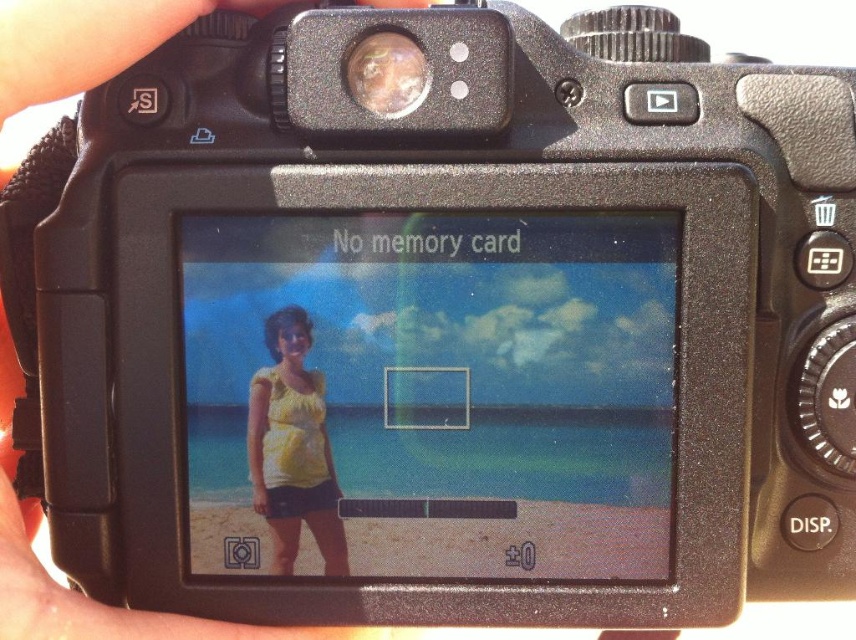
Can you confirm if yellow cotton shirt at center is positioned above metallic reflective lens at upper center?

No, yellow cotton shirt at center is not above metallic reflective lens at upper center.

Is yellow cotton shirt at center positioned before metallic reflective lens at upper center?

No.

Is point (263, 472) in front of point (376, 112)?

No, (263, 472) is further to viewer.

Identify the location of yellow cotton shirt at center. This screenshot has height=640, width=856. (293, 448).